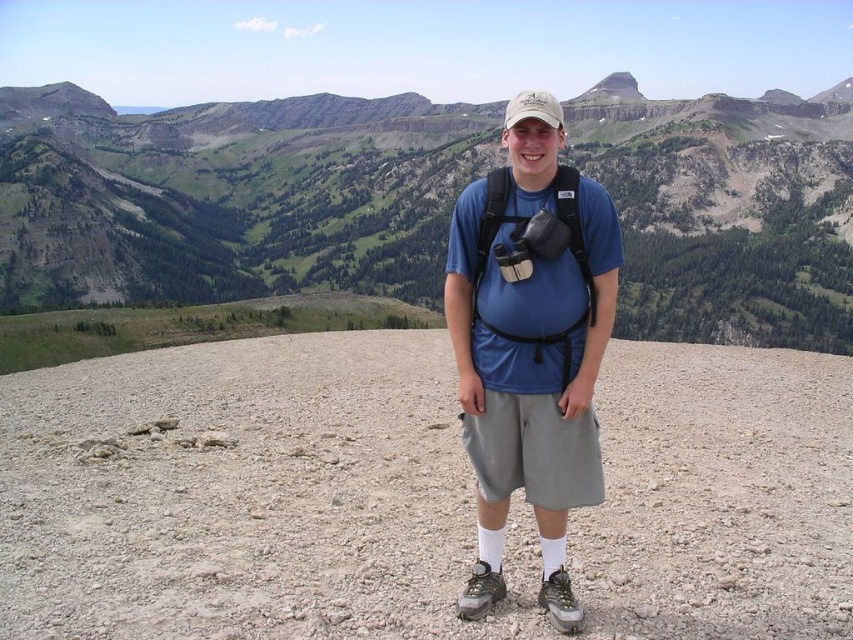
Is gray gravel at center bigger than green grassy mountain at center?

Incorrect, gray gravel at center is not larger than green grassy mountain at center.

This screenshot has height=640, width=853. What do you see at coordinates (248, 497) in the screenshot? I see `gray gravel at center` at bounding box center [248, 497].

Where is `gray gravel at center`? gray gravel at center is located at coordinates tap(248, 497).

The image size is (853, 640). Find the location of `gray gravel at center`. gray gravel at center is located at coordinates (248, 497).

Does point (405, 337) lie in front of point (543, 266)?

No, (405, 337) is further to viewer.

Does gray gravel at center appear on the right side of blue fabric backpack at center?

Yes, gray gravel at center is to the right of blue fabric backpack at center.

The width and height of the screenshot is (853, 640). Find the location of `gray gravel at center`. gray gravel at center is located at coordinates (248, 497).

Find the location of a particular element. gray gravel at center is located at coordinates (248, 497).

Which is behind, point (279, 136) or point (519, 298)?

The point (279, 136) is behind.

Consider the image. Can you confirm if green grassy mountain at center is wider than blue fabric backpack at center?

Correct, the width of green grassy mountain at center exceeds that of blue fabric backpack at center.

Find the location of a particular element. This screenshot has width=853, height=640. green grassy mountain at center is located at coordinates (229, 196).